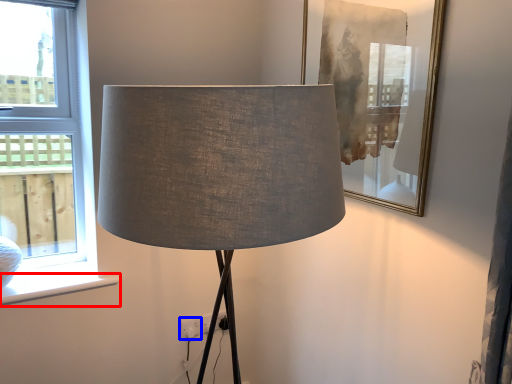
Question: Which object appears farthest to the camera in this image, window sill (highlighted by a red box) or electric outlet (highlighted by a blue box)?

Choices:
 (A) window sill
 (B) electric outlet

Answer: (B)